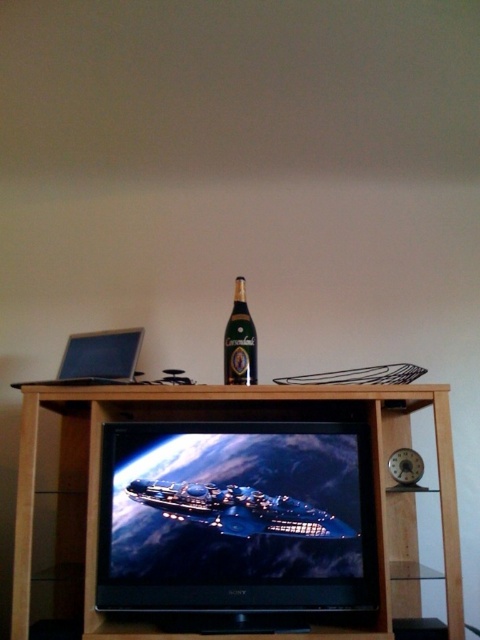
Is point (176, 400) positioned after point (238, 284)?

That is False.

Can you confirm if black wood entertainment center at center is positioned above green glass bottle at center?

Actually, black wood entertainment center at center is below green glass bottle at center.

Where is `black wood entertainment center at center`? The height and width of the screenshot is (640, 480). black wood entertainment center at center is located at coordinates (228, 419).

Which is more to the right, black glossy flat screen tv at center or matte black laptop at left?

From the viewer's perspective, black glossy flat screen tv at center appears more on the right side.

Does point (104, 573) lie in front of point (118, 358)?

Yes.

Where is `black glossy flat screen tv at center`? This screenshot has height=640, width=480. black glossy flat screen tv at center is located at coordinates (236, 518).

Does black wood entertainment center at center come behind matte black laptop at left?

No, black wood entertainment center at center is in front of matte black laptop at left.

Is black wood entertainment center at center smaller than matte black laptop at left?

No, black wood entertainment center at center is not smaller than matte black laptop at left.

Is point (195, 392) farther from camera compared to point (120, 332)?

No, it is not.

Identify the location of black wood entertainment center at center. (228, 419).